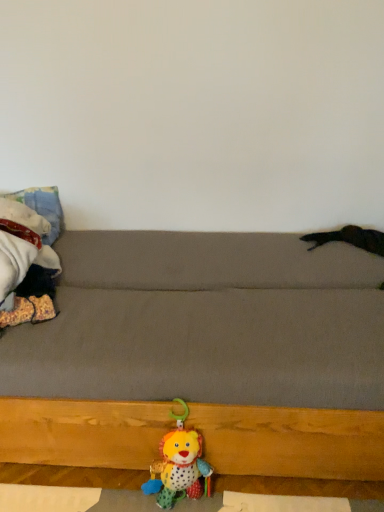
Question: Is soft plush lion at lower center, which ranks as the first toy in bottom-to-top order, to the right of fluffy fabric blanket at left, marked as the 1th toy in a left-to-right arrangement, from the viewer's perspective?

Choices:
 (A) no
 (B) yes

Answer: (B)

Question: Can you confirm if soft plush lion at lower center, which is counted as the 2th toy, starting from the left, is smaller than fluffy fabric blanket at left, which is the 2th toy in right-to-left order?

Choices:
 (A) yes
 (B) no

Answer: (A)

Question: Can you confirm if soft plush lion at lower center, which ranks as the first toy in bottom-to-top order, is taller than fluffy fabric blanket at left, which is the 2th toy in right-to-left order?

Choices:
 (A) yes
 (B) no

Answer: (A)

Question: Is soft plush lion at lower center, which ranks as the second toy in top-to-bottom order, located outside fluffy fabric blanket at left, which is the 2th toy in bottom-to-top order?

Choices:
 (A) no
 (B) yes

Answer: (B)

Question: Is soft plush lion at lower center, which is the 1th toy in right-to-left order, to the left of fluffy fabric blanket at left, the 1th toy when ordered from top to bottom, from the viewer's perspective?

Choices:
 (A) no
 (B) yes

Answer: (A)

Question: Is soft plush lion at lower center, which ranks as the first toy in bottom-to-top order, positioned in front of fluffy fabric blanket at left, which is the 2th toy in right-to-left order?

Choices:
 (A) no
 (B) yes

Answer: (B)

Question: Would you say gray fabric couch at center is part of fluffy fabric blanket at left, the 1th toy when ordered from top to bottom,'s contents?

Choices:
 (A) no
 (B) yes

Answer: (A)

Question: Considering the relative sizes of fluffy fabric blanket at left, which is the 2th toy in bottom-to-top order, and gray fabric couch at center in the image provided, is fluffy fabric blanket at left, which is the 2th toy in bottom-to-top order, taller than gray fabric couch at center?

Choices:
 (A) no
 (B) yes

Answer: (A)

Question: Can you confirm if fluffy fabric blanket at left, which is the 2th toy in right-to-left order, is smaller than gray fabric couch at center?

Choices:
 (A) no
 (B) yes

Answer: (B)

Question: Is fluffy fabric blanket at left, which is the 2th toy in bottom-to-top order, at the right side of gray fabric couch at center?

Choices:
 (A) no
 (B) yes

Answer: (A)

Question: Considering the relative sizes of fluffy fabric blanket at left, the 1th toy when ordered from top to bottom, and gray fabric couch at center in the image provided, is fluffy fabric blanket at left, the 1th toy when ordered from top to bottom, wider than gray fabric couch at center?

Choices:
 (A) no
 (B) yes

Answer: (A)

Question: Considering the relative sizes of fluffy fabric blanket at left, which is the 2th toy in right-to-left order, and gray fabric couch at center in the image provided, is fluffy fabric blanket at left, which is the 2th toy in right-to-left order, thinner than gray fabric couch at center?

Choices:
 (A) no
 (B) yes

Answer: (B)

Question: From a real-world perspective, is gray fabric couch at center below fluffy fabric blanket at left, the 1th toy when ordered from top to bottom?

Choices:
 (A) no
 (B) yes

Answer: (B)